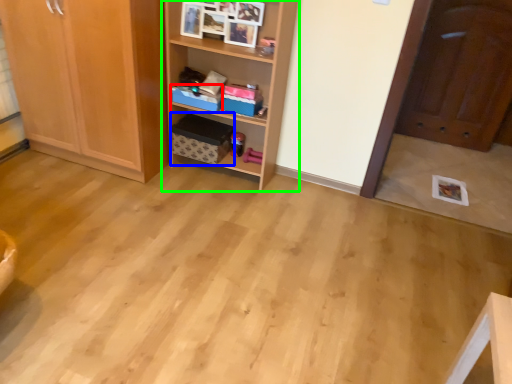
Question: Based on their relative distances, which object is nearer to storage box (highlighted by a red box)? Choose from cardboard box (highlighted by a blue box) and shelf (highlighted by a green box).

Choices:
 (A) cardboard box
 (B) shelf

Answer: (A)